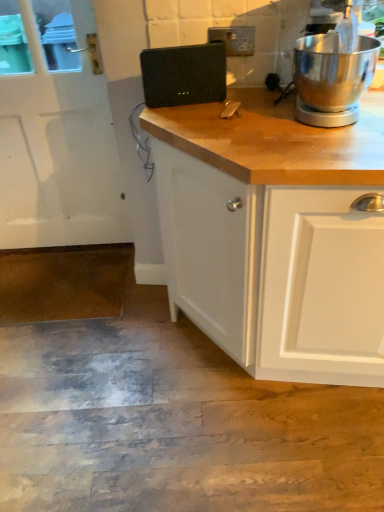
Question: From a real-world perspective, does black plastic speaker at center sit lower than white matte screen door at left?

Choices:
 (A) yes
 (B) no

Answer: (B)

Question: Does black plastic speaker at center come in front of white matte screen door at left?

Choices:
 (A) no
 (B) yes

Answer: (B)

Question: Does black plastic speaker at center have a greater height compared to white matte screen door at left?

Choices:
 (A) no
 (B) yes

Answer: (A)

Question: From the image's perspective, is black plastic speaker at center on top of white matte screen door at left?

Choices:
 (A) yes
 (B) no

Answer: (A)

Question: Is black plastic speaker at center smaller than white matte screen door at left?

Choices:
 (A) yes
 (B) no

Answer: (A)

Question: Is black plastic speaker at center taller or shorter than polished stainless steel stand mixer at upper right?

Choices:
 (A) short
 (B) tall

Answer: (A)

Question: Is black plastic speaker at center to the left or to the right of polished stainless steel stand mixer at upper right in the image?

Choices:
 (A) right
 (B) left

Answer: (B)

Question: Is black plastic speaker at center inside or outside of polished stainless steel stand mixer at upper right?

Choices:
 (A) outside
 (B) inside

Answer: (A)

Question: In the image, is black plastic speaker at center positioned in front of or behind polished stainless steel stand mixer at upper right?

Choices:
 (A) front
 (B) behind

Answer: (B)

Question: In terms of width, does white matte screen door at left look wider or thinner when compared to black plastic speaker at center?

Choices:
 (A) wide
 (B) thin

Answer: (A)

Question: Which is correct: white matte screen door at left is inside black plastic speaker at center, or outside of it?

Choices:
 (A) inside
 (B) outside

Answer: (B)

Question: Is white matte screen door at left bigger or smaller than black plastic speaker at center?

Choices:
 (A) small
 (B) big

Answer: (B)

Question: In the image, is white matte screen door at left on the left side or the right side of black plastic speaker at center?

Choices:
 (A) left
 (B) right

Answer: (A)

Question: Considering the relative positions of white matte screen door at left and polished stainless steel stand mixer at upper right in the image provided, is white matte screen door at left to the left or to the right of polished stainless steel stand mixer at upper right?

Choices:
 (A) left
 (B) right

Answer: (A)

Question: Considering the positions of white matte screen door at left and polished stainless steel stand mixer at upper right in the image, is white matte screen door at left taller or shorter than polished stainless steel stand mixer at upper right?

Choices:
 (A) short
 (B) tall

Answer: (B)